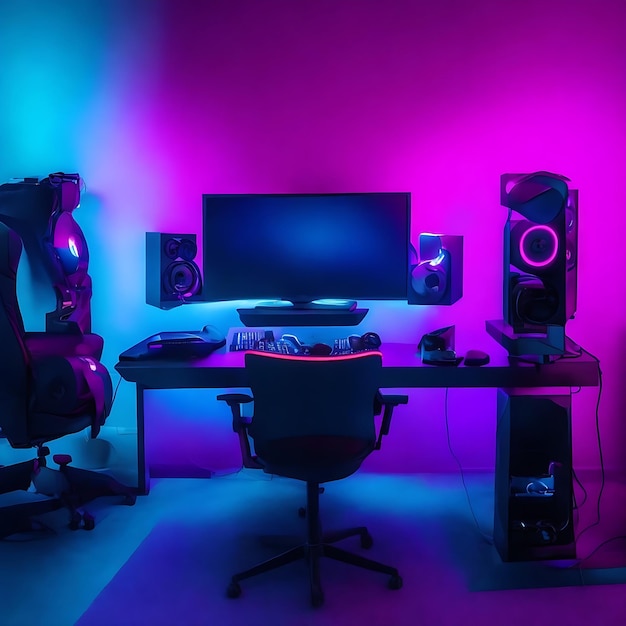
Locate an element on the screen. speakers is located at coordinates (165, 257), (442, 260), (516, 239).